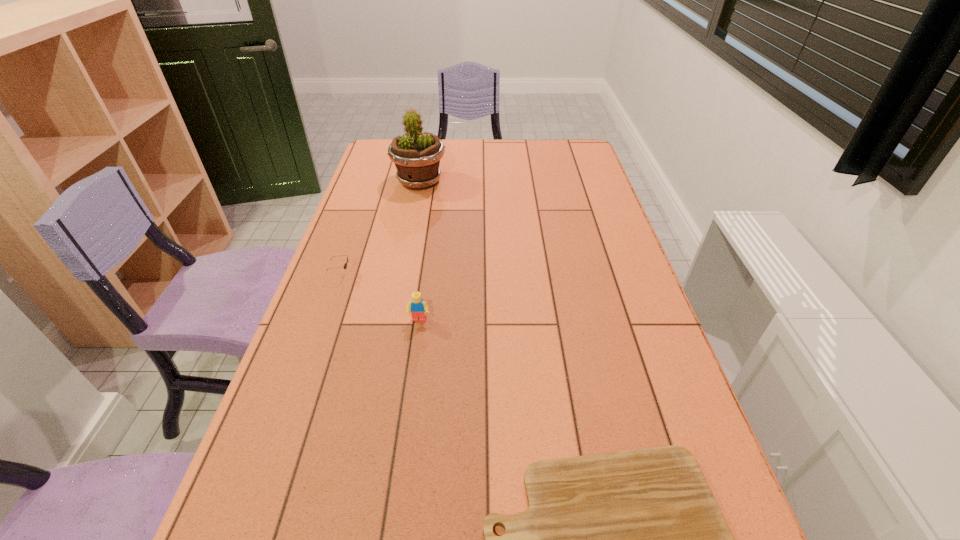
Where is `the tallest object`? the tallest object is located at coordinates (416, 155).

Locate an element on the screen. The width and height of the screenshot is (960, 540). flowerpot is located at coordinates (416, 155).

Find the location of a particular element. This screenshot has width=960, height=540. Lego is located at coordinates click(x=418, y=307).

The image size is (960, 540). Find the location of `the third shortest object`. the third shortest object is located at coordinates (418, 307).

You are a GUI agent. You are given a task and a screenshot of the screen. Output one action in this format:
    pyautogui.click(x=<x>, y=<y>)
    Task: Click on the third nearest object
    
    Given the screenshot: What is the action you would take?
    pyautogui.click(x=345, y=265)

Find the location of `sunglasses`. sunglasses is located at coordinates (345, 265).

Find the location of a particular element. free space located on the back of the flowerpot is located at coordinates (426, 150).

I want to click on free space located 0.230m on the front-facing side of the third farthest object, so click(407, 407).

The image size is (960, 540). In order to click on free point located 0.090m in front of the lenses of the third nearest object in this screenshot , I will do `click(383, 274)`.

Locate an element on the screen. The image size is (960, 540). flowerpot situated at the left edge is located at coordinates (416, 155).